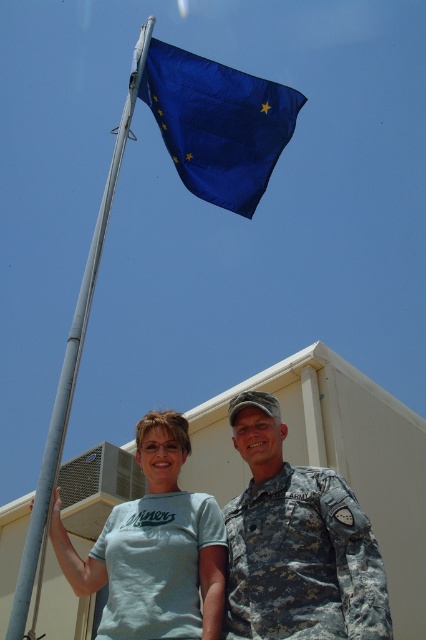
Measure the distance between point (374, 544) and camera.

Point (374, 544) is 12.00 meters away from camera.

Which is above, camouflage uniform at lower center or silver metallic flag pole at left?

silver metallic flag pole at left

You are a GUI agent. You are given a task and a screenshot of the screen. Output one action in this format:
    pyautogui.click(x=<x>, y=<y>)
    Task: Click on the camouflage uniform at lower center
    The image size is (426, 640).
    Given the screenshot: What is the action you would take?
    pyautogui.click(x=233, y=547)

Who is lower down, camouflage uniform at center or camouflage fabric uniform at lower right?

camouflage fabric uniform at lower right is below.

Does camouflage uniform at center come in front of camouflage fabric uniform at lower right?

Yes, camouflage uniform at center is in front of camouflage fabric uniform at lower right.

Which is behind, point (356, 502) or point (131, 628)?

The point (356, 502) is behind.

This screenshot has width=426, height=640. In order to click on camouflage uniform at center in this screenshot , I will do `click(296, 544)`.

Does camouflage uniform at lower center lie in front of camouflage uniform at center?

No, it is behind camouflage uniform at center.

Is point (313, 500) more distant than point (282, 529)?

Yes.

Where is `camouflage uniform at lower center`? camouflage uniform at lower center is located at coordinates (233, 547).